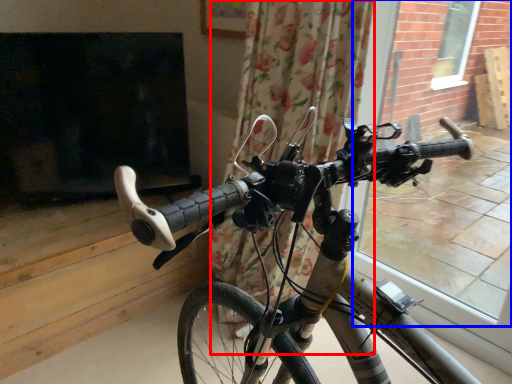
Question: Which object appears closest to the camera in this image, curtain (highlighted by a red box) or window frame (highlighted by a blue box)?

Choices:
 (A) curtain
 (B) window frame

Answer: (A)